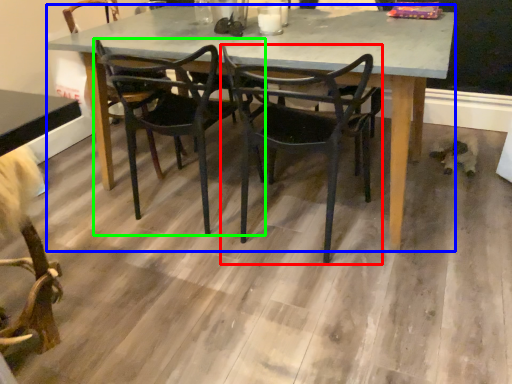
Question: Based on their relative distances, which object is farther from chair (highlighted by a red box)? Choose from kitchen & dining room table (highlighted by a blue box) and chair (highlighted by a green box).

Choices:
 (A) kitchen & dining room table
 (B) chair

Answer: (B)